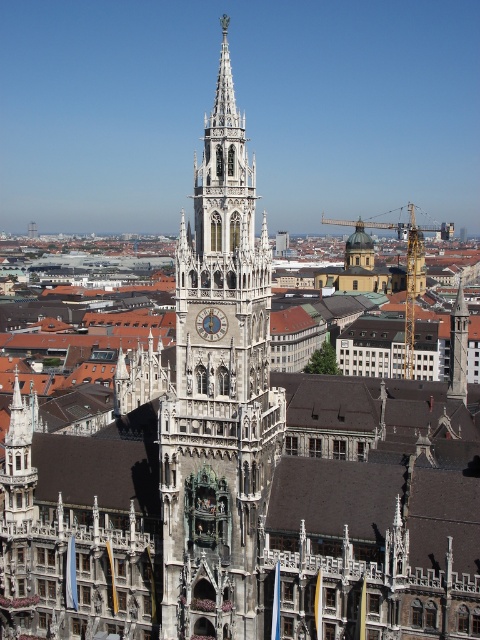
You are standing in front of the New Town Hall in Munich. You notice the white stone clock tower at center and the matte gray clock at center. Which one is positioned higher in the scene?

The white stone clock tower at center is above the matte gray clock at center, so the white stone clock tower at center is positioned higher in the scene.

You are standing in front of the New Town Hall in Munich and want to take a photo that includes both the tower and the surrounding buildings. You notice two points marked on your map at coordinates point (250, 266) and point (223, 323). Which point should you stand closer to ensure both the tower and the surrounding buildings are in frame?

You should stand closer to point (250, 266) because it is closer to the viewer, allowing you to capture both the tower and the surrounding buildings in the frame more effectively.

You are standing in front of the New Town Hall in Munich and want to take a photo of the white stone clock tower at center. If your camera can capture objects up to 200 feet away, will the tower be in focus?

The white stone clock tower at center is 202.89 feet away from the camera, which exceeds the camera maximum range of 200 feet. Therefore, the tower will not be in focus.